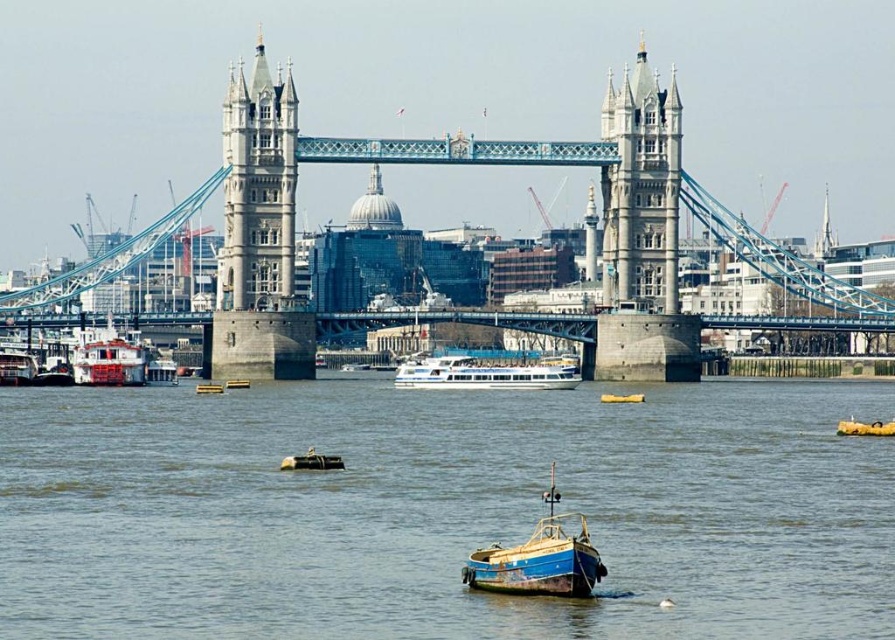
Is blue metallic bridge at center below stone stonework tower at center?

Correct, blue metallic bridge at center is located below stone stonework tower at center.

Is point (253, 352) positioned behind point (615, 172)?

No, (253, 352) is closer to viewer.

Locate an element on the screen. The image size is (895, 640). blue metallic bridge at center is located at coordinates (461, 164).

Between point (483, 584) and point (611, 397), which one is positioned behind?

The point (611, 397) is more distant.

Locate an element on the screen. The height and width of the screenshot is (640, 895). blue wooden boat at center is located at coordinates (539, 557).

Locate an element on the screen. This screenshot has height=640, width=895. blue wooden boat at center is located at coordinates (539, 557).

Is the position of stone stonework tower at center more distant than that of blue wooden boat at center?

Yes, it is.

Describe the element at coordinates (641, 189) in the screenshot. The height and width of the screenshot is (640, 895). I see `stone stonework tower at center` at that location.

The width and height of the screenshot is (895, 640). Describe the element at coordinates (641, 189) in the screenshot. I see `stone stonework tower at center` at that location.

Locate an element on the screen. The width and height of the screenshot is (895, 640). stone stonework tower at center is located at coordinates (641, 189).